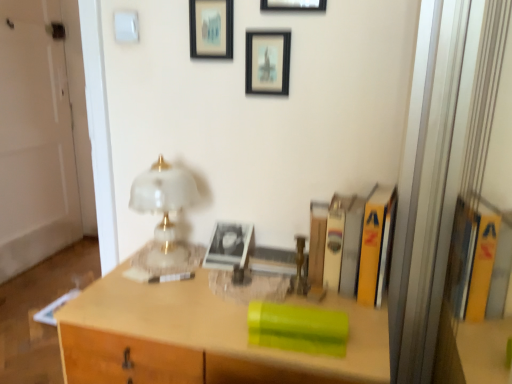
Question: Considering the relative sizes of hardcover book at center, the 2th book in the right-to-left sequence, and white glossy door at left in the image provided, is hardcover book at center, the 2th book in the right-to-left sequence, smaller than white glossy door at left?

Choices:
 (A) yes
 (B) no

Answer: (A)

Question: Does hardcover book at center, the 2th book in the right-to-left sequence, have a lesser height compared to white glossy door at left?

Choices:
 (A) yes
 (B) no

Answer: (A)

Question: Does hardcover book at center, the second book positioned from the left, come behind white glossy door at left?

Choices:
 (A) yes
 (B) no

Answer: (B)

Question: Is hardcover book at center, the 2th book in the right-to-left sequence, beside white glossy door at left?

Choices:
 (A) no
 (B) yes

Answer: (A)

Question: Is hardcover book at center, the 2th book in the right-to-left sequence, closer to the viewer compared to white glossy door at left?

Choices:
 (A) yes
 (B) no

Answer: (A)

Question: From the image's perspective, is hardcover book at center, the 2th book in the right-to-left sequence, positioned above or below green plastic container at center?

Choices:
 (A) above
 (B) below

Answer: (A)

Question: Is hardcover book at center, the 2th book in the right-to-left sequence, spatially inside green plastic container at center, or outside of it?

Choices:
 (A) inside
 (B) outside

Answer: (B)

Question: Considering their positions, is hardcover book at center, the 2th book in the right-to-left sequence, located in front of or behind green plastic container at center?

Choices:
 (A) front
 (B) behind

Answer: (B)

Question: Is point (328, 259) positioned closer to the camera than point (268, 370)?

Choices:
 (A) closer
 (B) farther

Answer: (B)

Question: In terms of height, does matte black picture frame at upper center, the second picture frame viewed from the left, look taller or shorter compared to wooden picture frame at upper center, which appears as the 3th picture frame when viewed from the left?

Choices:
 (A) short
 (B) tall

Answer: (B)

Question: Considering their positions, is matte black picture frame at upper center, the second picture frame viewed from the left, located in front of or behind wooden picture frame at upper center, which appears as the 3th picture frame when viewed from the left?

Choices:
 (A) behind
 (B) front

Answer: (A)

Question: Is point (274, 61) positioned closer to the camera than point (269, 3)?

Choices:
 (A) farther
 (B) closer

Answer: (A)

Question: From the image's perspective, relative to wooden picture frame at upper center, which is counted as the first picture frame, starting from the right, is matte black picture frame at upper center, the second picture frame viewed from the left, above or below?

Choices:
 (A) above
 (B) below

Answer: (B)

Question: Considering the positions of point (393, 196) and point (179, 203), is point (393, 196) closer or farther from the camera than point (179, 203)?

Choices:
 (A) closer
 (B) farther

Answer: (A)

Question: From a real-world perspective, is yellow hardcover book at right, positioned as the first book in right-to-left order, positioned above or below matte glass table lamp at center?

Choices:
 (A) below
 (B) above

Answer: (A)